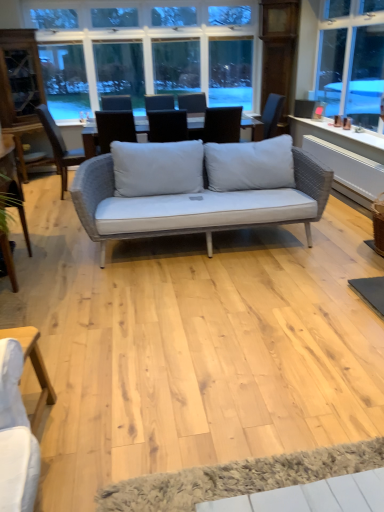
Locate an element on the screen. The height and width of the screenshot is (512, 384). vacant area that lies between light wood table at lower left and white textured yoga mat at lower center is located at coordinates (155, 445).